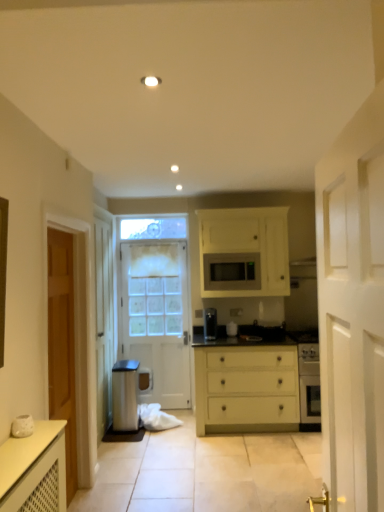
Question: From the image's perspective, does white wooden door at right, the 2th door viewed from the right, appear higher than matte black microwave at center?

Choices:
 (A) yes
 (B) no

Answer: (B)

Question: Is white wooden door at right, which appears as the first door when viewed from the front, smaller than matte black microwave at center?

Choices:
 (A) no
 (B) yes

Answer: (A)

Question: Is white wooden door at right, the second door viewed from the left, turned away from matte black microwave at center?

Choices:
 (A) no
 (B) yes

Answer: (A)

Question: Is white wooden door at right, placed as the 3th door when sorted from back to front, surrounding matte black microwave at center?

Choices:
 (A) no
 (B) yes

Answer: (A)

Question: Is white wooden door at right, which appears as the first door when viewed from the front, at the left side of matte black microwave at center?

Choices:
 (A) yes
 (B) no

Answer: (A)

Question: From the image's perspective, is matte black microwave at center located above or below white painted wood door at center, positioned as the third door in right-to-left order?

Choices:
 (A) below
 (B) above

Answer: (B)

Question: Does point (215, 262) appear closer or farther from the camera than point (180, 397)?

Choices:
 (A) closer
 (B) farther

Answer: (A)

Question: Looking at the image, does matte black microwave at center seem bigger or smaller compared to white painted wood door at center, the third door from the front?

Choices:
 (A) big
 (B) small

Answer: (B)

Question: In the image, is matte black microwave at center positioned in front of or behind white painted wood door at center, which appears as the first door when viewed from the back?

Choices:
 (A) front
 (B) behind

Answer: (A)

Question: Considering the relative positions of matte yellow chest of drawers at center and white painted wood door at center, positioned as the third door in right-to-left order, in the image provided, is matte yellow chest of drawers at center to the left or to the right of white painted wood door at center, positioned as the third door in right-to-left order,?

Choices:
 (A) right
 (B) left

Answer: (A)

Question: Considering the positions of matte yellow chest of drawers at center and white painted wood door at center, which appears as the 1th door when viewed from the left, in the image, is matte yellow chest of drawers at center taller or shorter than white painted wood door at center, which appears as the 1th door when viewed from the left,?

Choices:
 (A) tall
 (B) short

Answer: (B)

Question: Considering the positions of matte yellow chest of drawers at center and white painted wood door at center, positioned as the third door in right-to-left order, in the image, is matte yellow chest of drawers at center wider or thinner than white painted wood door at center, positioned as the third door in right-to-left order,?

Choices:
 (A) wide
 (B) thin

Answer: (A)

Question: From a real-world perspective, relative to white painted wood door at center, which appears as the first door when viewed from the back, is matte yellow chest of drawers at center vertically above or below?

Choices:
 (A) below
 (B) above

Answer: (A)

Question: Considering the relative positions of matte yellow chest of drawers at center and white wooden door at right, which appears as the first door when viewed from the front, in the image provided, is matte yellow chest of drawers at center to the left or to the right of white wooden door at right, which appears as the first door when viewed from the front,?

Choices:
 (A) left
 (B) right

Answer: (B)

Question: In terms of width, does matte yellow chest of drawers at center look wider or thinner when compared to white wooden door at right, the 2th door viewed from the right?

Choices:
 (A) thin
 (B) wide

Answer: (B)